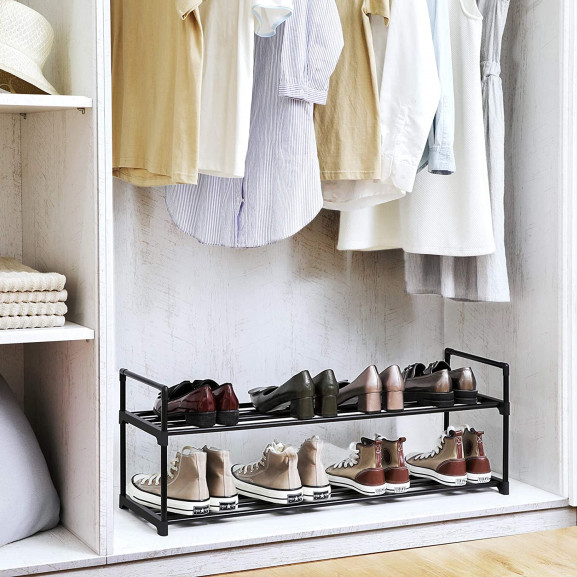
You are a GUI agent. You are given a task and a screenshot of the screen. Output one action in this format:
    pyautogui.click(x=<x>, y=<y>)
    Task: Click on the shoes on the bottom rack
    This screenshot has height=577, width=577.
    Given the screenshot: What is the action you would take?
    pyautogui.click(x=192, y=482), pyautogui.click(x=224, y=483), pyautogui.click(x=264, y=477), pyautogui.click(x=313, y=470), pyautogui.click(x=372, y=475), pyautogui.click(x=388, y=470), pyautogui.click(x=438, y=464), pyautogui.click(x=478, y=460)